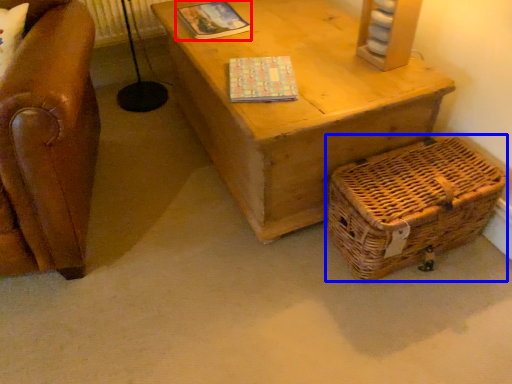
Question: Among these objects, which one is farthest to the camera, magazine (highlighted by a red box) or basket (highlighted by a blue box)?

Choices:
 (A) magazine
 (B) basket

Answer: (A)